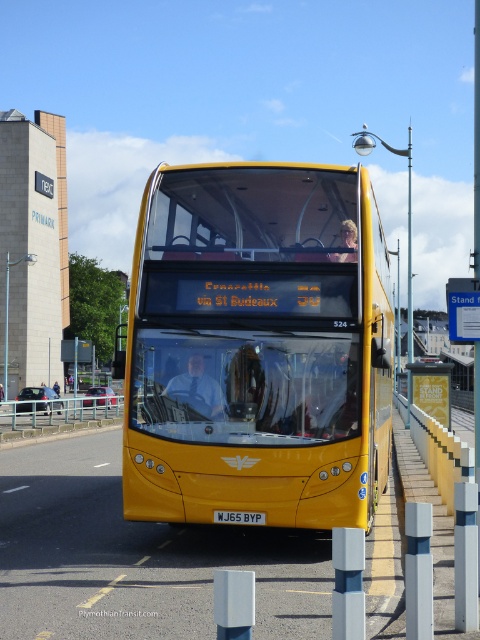
Can you confirm if yellow matte/decorative bus at center is thinner than metallic yellow bus stop at right?

Yes, yellow matte/decorative bus at center is thinner than metallic yellow bus stop at right.

Can you confirm if yellow matte/decorative bus at center is wider than metallic yellow bus stop at right?

In fact, yellow matte/decorative bus at center might be narrower than metallic yellow bus stop at right.

Which is behind, point (192, 204) or point (428, 384)?

Point (428, 384)

Where is `yellow matte/decorative bus at center`? yellow matte/decorative bus at center is located at coordinates (257, 346).

Is point (266, 244) closer to viewer compared to point (220, 518)?

That is False.

Which is more to the right, yellow matte/decorative bus at center or white plastic license plate at center?

Positioned to the right is yellow matte/decorative bus at center.

Image resolution: width=480 pixels, height=640 pixels. What do you see at coordinates (257, 346) in the screenshot? I see `yellow matte/decorative bus at center` at bounding box center [257, 346].

The height and width of the screenshot is (640, 480). Identify the location of yellow matte/decorative bus at center. (257, 346).

Between metallic yellow bus stop at right and white plastic license plate at center, which one is positioned lower?

metallic yellow bus stop at right is below.

Between metallic yellow bus stop at right and white plastic license plate at center, which one has more height?

metallic yellow bus stop at right is taller.

Locate an element on the screen. Image resolution: width=480 pixels, height=640 pixels. metallic yellow bus stop at right is located at coordinates tap(432, 388).